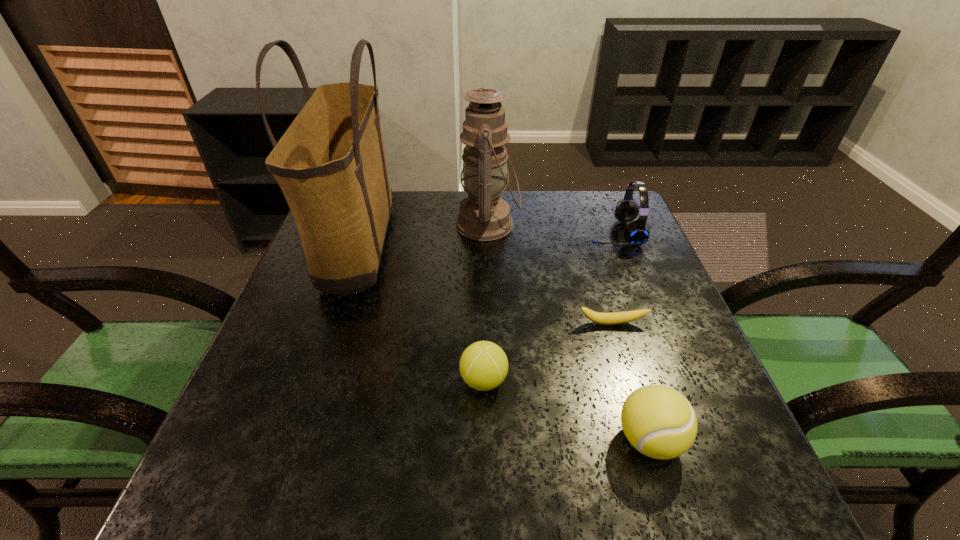
Identify the location of free location located 0.060m on the right of the tallest object. The image size is (960, 540). (419, 251).

At what (x,y) coordinates should I click in order to perform the action: click on vacant space located on the left of the fifth shortest object. Please return your answer as a coordinate pair (x, y). This screenshot has height=540, width=960. Looking at the image, I should click on (368, 224).

Where is `vacant region located 0.310m on the ear cushions of the third tallest object`? The width and height of the screenshot is (960, 540). vacant region located 0.310m on the ear cushions of the third tallest object is located at coordinates (473, 233).

The height and width of the screenshot is (540, 960). What are the coordinates of `blank area located 0.390m on the ear cushions of the third tallest object` in the screenshot? It's located at (444, 233).

This screenshot has width=960, height=540. What are the coordinates of `free space located 0.220m on the ear cushions of the third tallest object` in the screenshot? It's located at (506, 233).

Where is `vacant space located 0.090m on the left of the nearer tennis ball`? This screenshot has height=540, width=960. vacant space located 0.090m on the left of the nearer tennis ball is located at coordinates (563, 440).

Identify the location of free location located 0.360m on the right of the farther tennis ball. (695, 380).

Locate an element on the screen. The width and height of the screenshot is (960, 540). free space located on the upward curve of the banana is located at coordinates (620, 353).

Locate an element on the screen. The width and height of the screenshot is (960, 540). tote bag present at the far edge is located at coordinates (330, 164).

This screenshot has height=540, width=960. Identify the location of oil lamp located at the far edge. (484, 215).